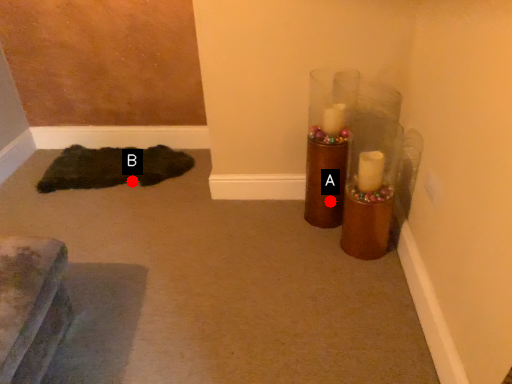
Question: Two points are circled on the image, labeled by A and B beside each circle. Among these points, which one is farthest from the camera?

Choices:
 (A) A is further
 (B) B is further

Answer: (B)